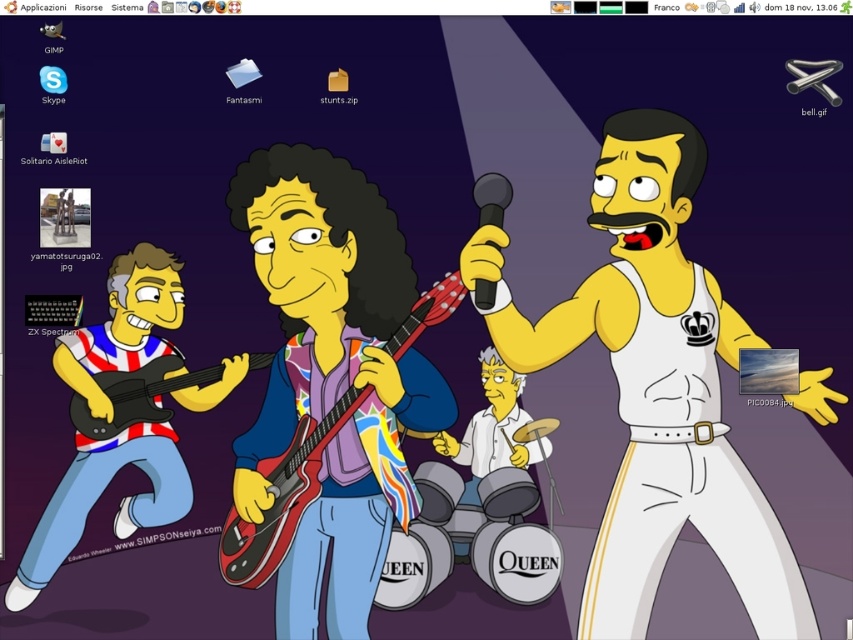
Consider the image. Who is taller, brushed metal guitar at left or black matte microphone at upper center?

brushed metal guitar at left

At what (x,y) coordinates should I click in order to perform the action: click on brushed metal guitar at left. Please return your answer as a coordinate pair (x, y). Looking at the image, I should click on (136, 396).

Which is in front, point (126, 413) or point (500, 196)?

Point (500, 196) is more forward.

The height and width of the screenshot is (640, 853). Identify the location of brushed metal guitar at left. (136, 396).

Can you confirm if shiny metallic guitar at center is taller than white matte drum set at center?

Yes, shiny metallic guitar at center is taller than white matte drum set at center.

Does shiny metallic guitar at center appear over white matte drum set at center?

Indeed, shiny metallic guitar at center is positioned over white matte drum set at center.

Does point (274, 493) come behind point (485, 387)?

That is False.

The width and height of the screenshot is (853, 640). Find the location of `shiny metallic guitar at center`. shiny metallic guitar at center is located at coordinates pyautogui.click(x=282, y=499).

Is white matte drum set at center further to the viewer compared to black matte microphone at upper center?

Yes, white matte drum set at center is behind black matte microphone at upper center.

Consider the image. Is white matte drum set at center smaller than black matte microphone at upper center?

No, white matte drum set at center is not smaller than black matte microphone at upper center.

Describe the element at coordinates (491, 428) in the screenshot. I see `white matte drum set at center` at that location.

At what (x,y) coordinates should I click in order to perform the action: click on white matte drum set at center. Please return your answer as a coordinate pair (x, y). Looking at the image, I should click on (491, 428).